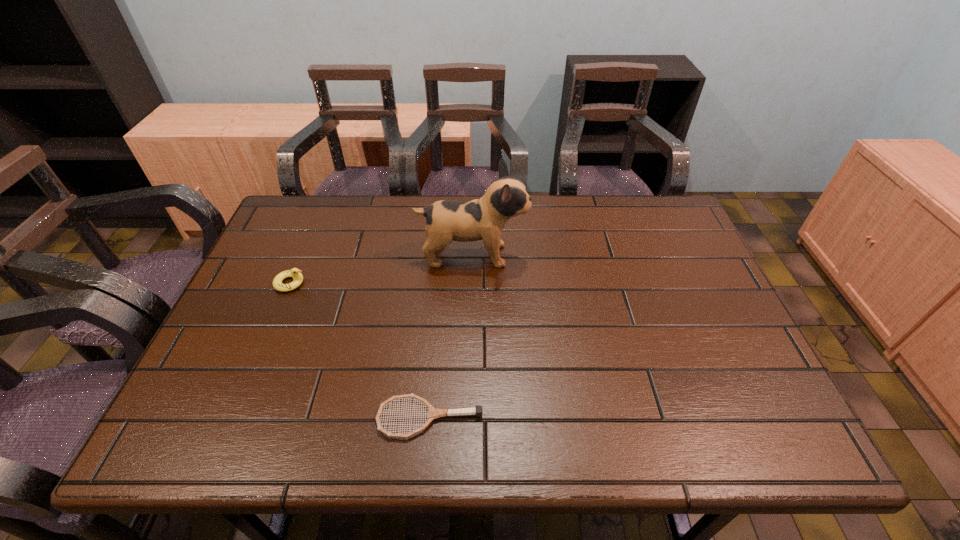
What are the coordinates of `vacant space that satisfies the following two spatial constraints: 1. at the face of the farthest object; 2. on the front side of the nearest object` in the screenshot? It's located at tap(469, 418).

Where is `free spot that satisfies the following two spatial constraints: 1. on the face of the duckling; 2. on the left side of the shortest object`? The height and width of the screenshot is (540, 960). free spot that satisfies the following two spatial constraints: 1. on the face of the duckling; 2. on the left side of the shortest object is located at coordinates (233, 418).

Identify the location of vacant region that satisfies the following two spatial constraints: 1. on the face of the tennis racket; 2. on the right side of the second nearest object. (233, 418).